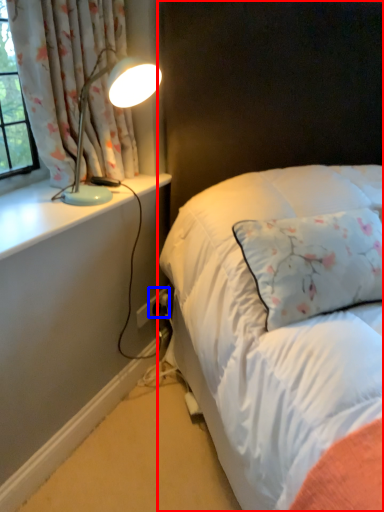
Question: Which object appears closest to the camera in this image, bed (highlighted by a red box) or electric outlet (highlighted by a blue box)?

Choices:
 (A) bed
 (B) electric outlet

Answer: (A)